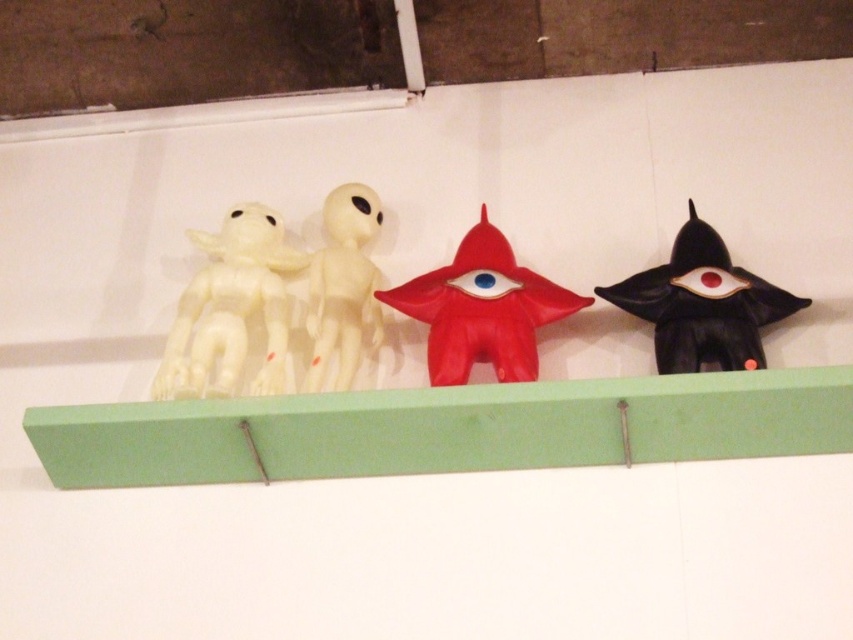
Does point (724, 328) come closer to viewer compared to point (308, 316)?

Yes, point (724, 328) is in front of point (308, 316).

Does black matte alien at right have a lesser height compared to white matte alien at center?

Yes.

Between point (764, 365) and point (326, 288), which one is positioned in front?

Point (764, 365)

Identify the location of black matte alien at right. The width and height of the screenshot is (853, 640). (701, 304).

Does red matte alien at center lie in front of black matte alien at right?

No, red matte alien at center is behind black matte alien at right.

Is point (553, 317) positioned after point (740, 323)?

That is True.

Measure the distance between red matte alien at center and camera.

The distance of red matte alien at center from camera is 5.54 feet.

Where is `red matte alien at center`? The image size is (853, 640). red matte alien at center is located at coordinates pyautogui.click(x=482, y=308).

Does point (204, 465) come in front of point (500, 253)?

Yes.

Is green wood at center above red matte alien at center?

No, green wood at center is not above red matte alien at center.

Is point (245, 413) behind point (496, 368)?

No, (245, 413) is closer to viewer.

Identify the location of green wood at center. The width and height of the screenshot is (853, 640). (445, 428).